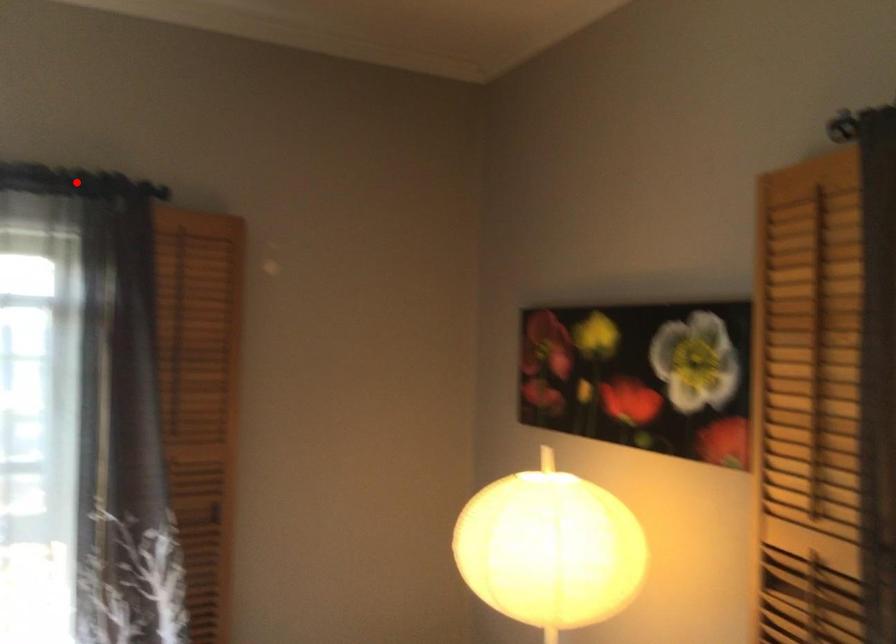
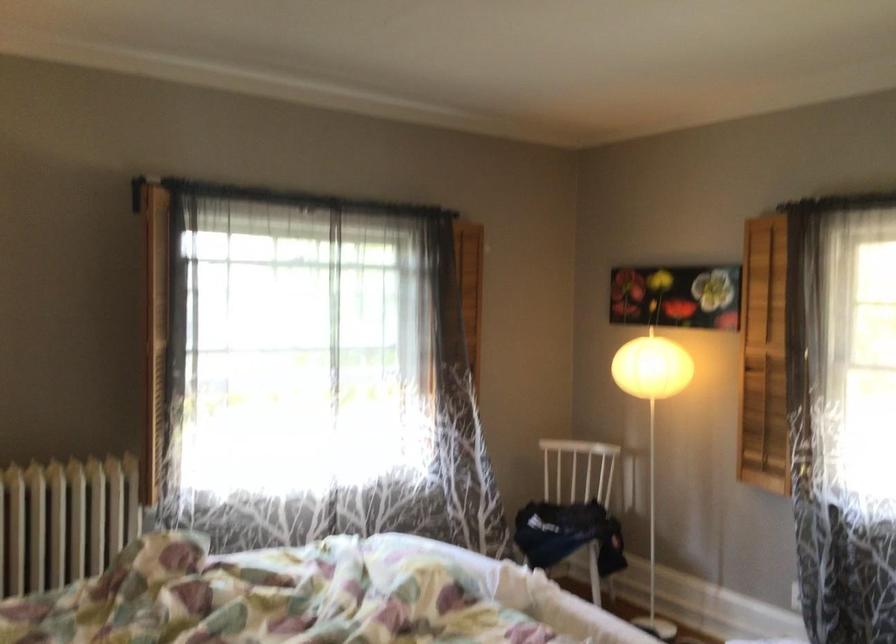
Question: I am providing you with two images of the same scene from different viewpoints. A red point is marked on the first image. Is the red point's position out of view in image 2?

Choices:
 (A) Yes
 (B) No

Answer: (A)